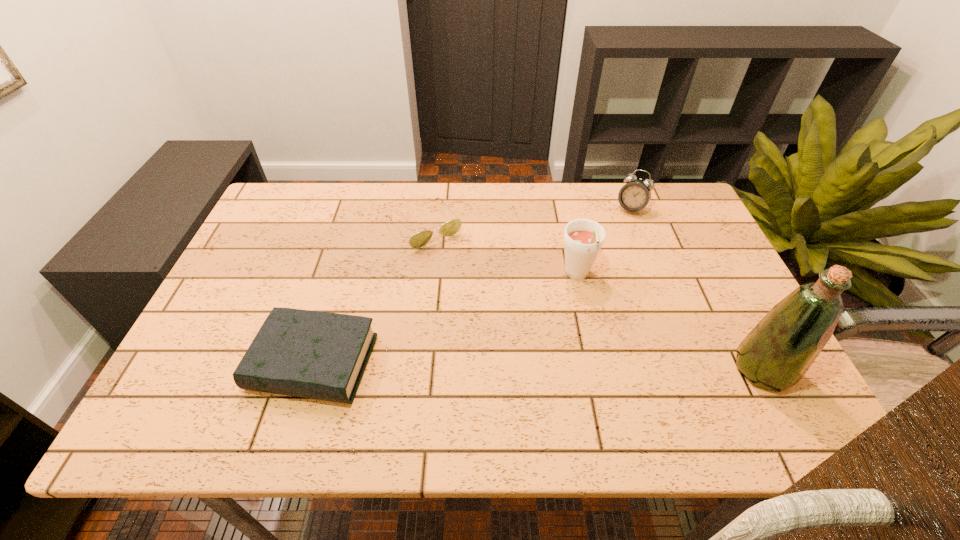
The width and height of the screenshot is (960, 540). I want to click on Bible positioned at the near edge, so (318, 355).

Identify the location of olive oil that is at the near edge. The width and height of the screenshot is (960, 540). (776, 354).

At what (x,y) coordinates should I click in order to perform the action: click on object that is positioned at the left edge. Please return your answer as a coordinate pair (x, y). The image size is (960, 540). Looking at the image, I should click on (318, 355).

At what (x,y) coordinates should I click in order to perform the action: click on olive oil that is at the right edge. Please return your answer as a coordinate pair (x, y). Image resolution: width=960 pixels, height=540 pixels. Looking at the image, I should click on (776, 354).

Identify the location of alarm clock that is at the right edge. This screenshot has height=540, width=960. (634, 196).

This screenshot has height=540, width=960. Identify the location of object that is at the near left corner. (318, 355).

This screenshot has width=960, height=540. What are the coordinates of `object situated at the far right corner` in the screenshot? It's located at (634, 196).

Find the location of a particular element. This screenshot has width=960, height=540. object positioned at the near right corner is located at coordinates (776, 354).

The image size is (960, 540). Find the location of `vacant point at the far edge`. vacant point at the far edge is located at coordinates (550, 183).

Where is `free spot at the left edge of the desktop`? The image size is (960, 540). free spot at the left edge of the desktop is located at coordinates (242, 345).